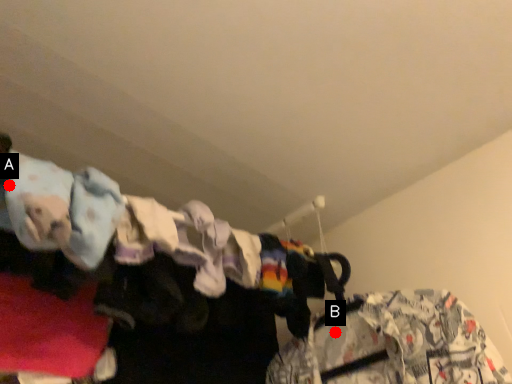
Question: Two points are circled on the image, labeled by A and B beside each circle. Which point is closer to the camera?

Choices:
 (A) A is closer
 (B) B is closer

Answer: (A)